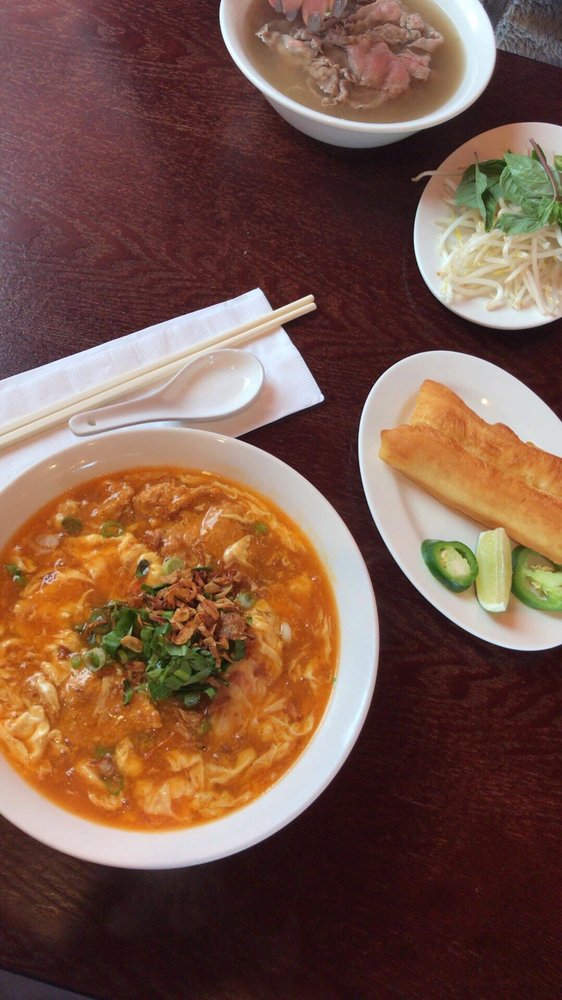
Locate an element on the screen. This screenshot has width=562, height=1000. plate is located at coordinates (475, 399).